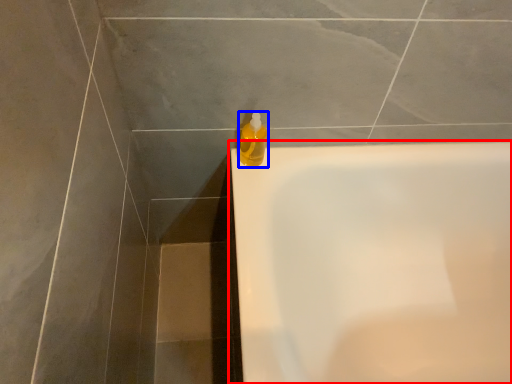
Question: Which of the following is the closest to the observer, bathtub (highlighted by a red box) or cleaning product (highlighted by a blue box)?

Choices:
 (A) bathtub
 (B) cleaning product

Answer: (A)